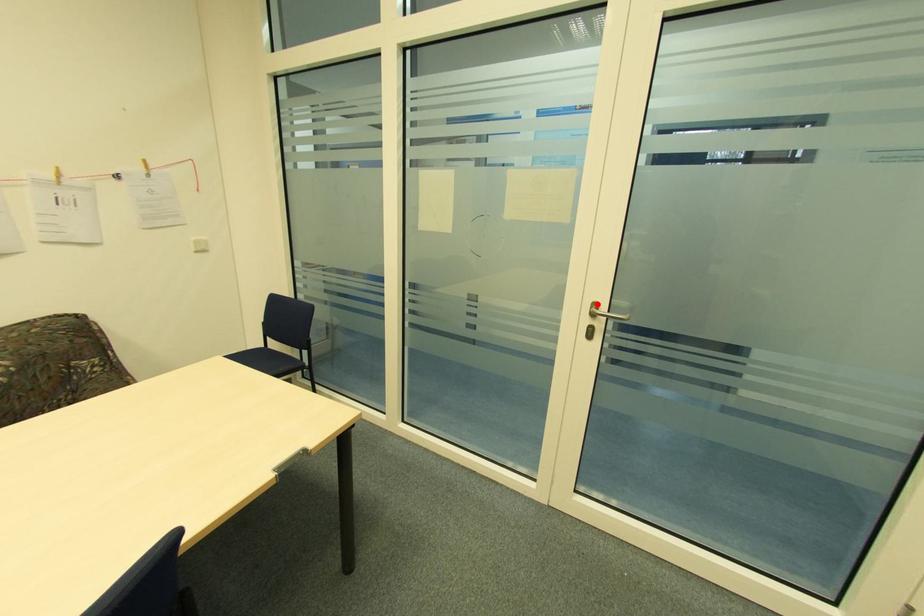
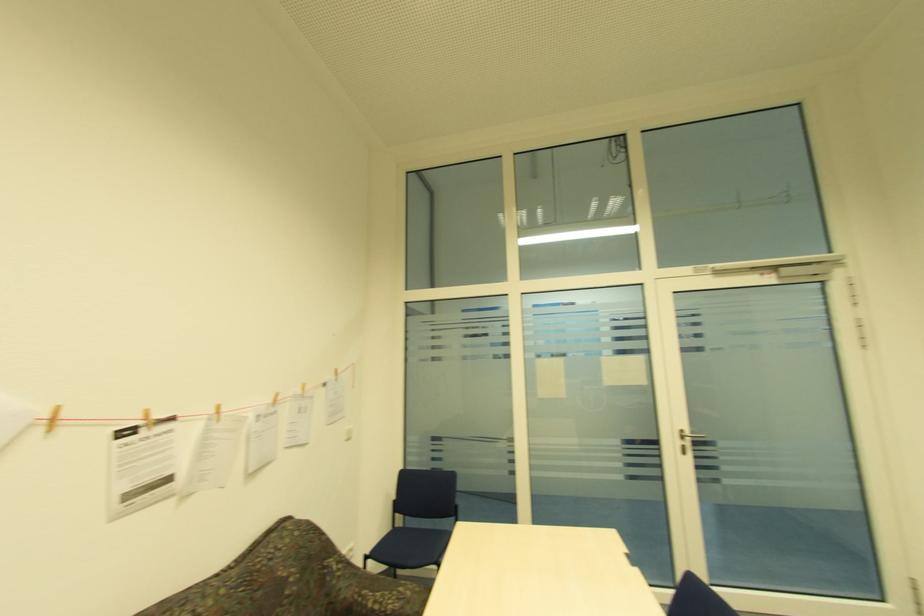
Question: I am providing you with two images of the same scene from different viewpoints. A red point is shown in image1. For the corresponding object point in image2, is it positioned nearer or farther from the camera?

Choices:
 (A) Nearer
 (B) Farther

Answer: (B)